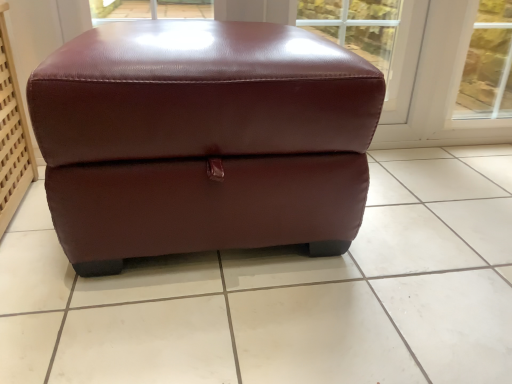
Question: Does point (320, 364) appear closer or farther from the camera than point (71, 99)?

Choices:
 (A) farther
 (B) closer

Answer: (A)

Question: Looking at their shapes, would you say burgundy leather ottoman at center is wider or thinner than burgundy leather ottoman at center?

Choices:
 (A) thin
 (B) wide

Answer: (B)

Question: Is burgundy leather ottoman at center inside or outside of burgundy leather ottoman at center?

Choices:
 (A) inside
 (B) outside

Answer: (B)

Question: Relative to burgundy leather ottoman at center, is burgundy leather ottoman at center in front or behind?

Choices:
 (A) behind
 (B) front

Answer: (A)

Question: Looking at the image, does burgundy leather ottoman at center seem bigger or smaller compared to burgundy leather ottoman at center?

Choices:
 (A) big
 (B) small

Answer: (A)

Question: Looking at their shapes, would you say burgundy leather ottoman at center is wider or thinner than burgundy leather ottoman at center?

Choices:
 (A) thin
 (B) wide

Answer: (A)

Question: From a real-world perspective, relative to burgundy leather ottoman at center, is burgundy leather ottoman at center vertically above or below?

Choices:
 (A) below
 (B) above

Answer: (B)